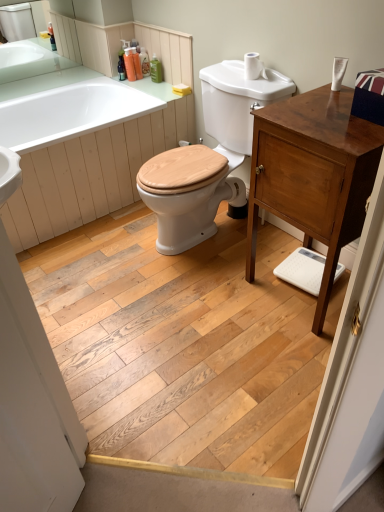
Question: Can you confirm if translucent plastic soap dispenser at upper center, placed as the third toiletry when sorted from left to right, is thinner than natural wood floor at center?

Choices:
 (A) no
 (B) yes

Answer: (B)

Question: Is natural wood floor at center a part of translucent plastic soap dispenser at upper center, arranged as the second toiletry when viewed from the right?

Choices:
 (A) yes
 (B) no

Answer: (B)

Question: Is translucent plastic soap dispenser at upper center, arranged as the second toiletry when viewed from the right, behind natural wood floor at center?

Choices:
 (A) yes
 (B) no

Answer: (A)

Question: Could you tell me if translucent plastic soap dispenser at upper center, placed as the third toiletry when sorted from left to right, is turned towards natural wood floor at center?

Choices:
 (A) no
 (B) yes

Answer: (A)

Question: Is translucent plastic soap dispenser at upper center, arranged as the second toiletry when viewed from the right, at the left side of natural wood floor at center?

Choices:
 (A) no
 (B) yes

Answer: (B)

Question: Does translucent plastic soap dispenser at upper center, arranged as the second toiletry when viewed from the right, have a smaller size compared to natural wood floor at center?

Choices:
 (A) no
 (B) yes

Answer: (B)

Question: Is natural wood floor at center beside white matte toilet paper at upper right?

Choices:
 (A) yes
 (B) no

Answer: (B)

Question: Is natural wood floor at center further to the viewer compared to white matte toilet paper at upper right?

Choices:
 (A) no
 (B) yes

Answer: (A)

Question: Does natural wood floor at center have a lesser height compared to white matte toilet paper at upper right?

Choices:
 (A) yes
 (B) no

Answer: (A)

Question: Is natural wood floor at center looking in the opposite direction of white matte toilet paper at upper right?

Choices:
 (A) yes
 (B) no

Answer: (B)

Question: Does natural wood floor at center appear on the right side of white matte toilet paper at upper right?

Choices:
 (A) no
 (B) yes

Answer: (A)

Question: Is natural wood floor at center bigger than white matte toilet paper at upper right?

Choices:
 (A) yes
 (B) no

Answer: (A)

Question: Considering the relative positions of white glossy bathtub at upper left and shiny brown cabinet at right in the image provided, is white glossy bathtub at upper left to the left of shiny brown cabinet at right from the viewer's perspective?

Choices:
 (A) no
 (B) yes

Answer: (B)